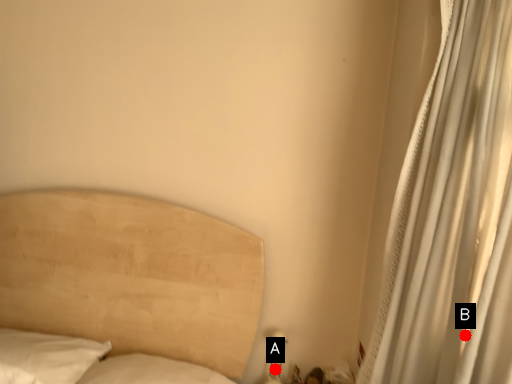
Question: Two points are circled on the image, labeled by A and B beside each circle. Which point appears closest to the camera in this image?

Choices:
 (A) A is closer
 (B) B is closer

Answer: (B)